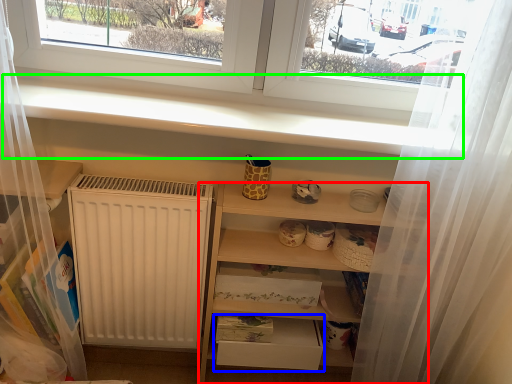
Question: Estimate the real-world distances between objects in this image. Which object is farther from shelf (highlighted by a red box), drawer (highlighted by a blue box) or window sill (highlighted by a green box)?

Choices:
 (A) drawer
 (B) window sill

Answer: (B)